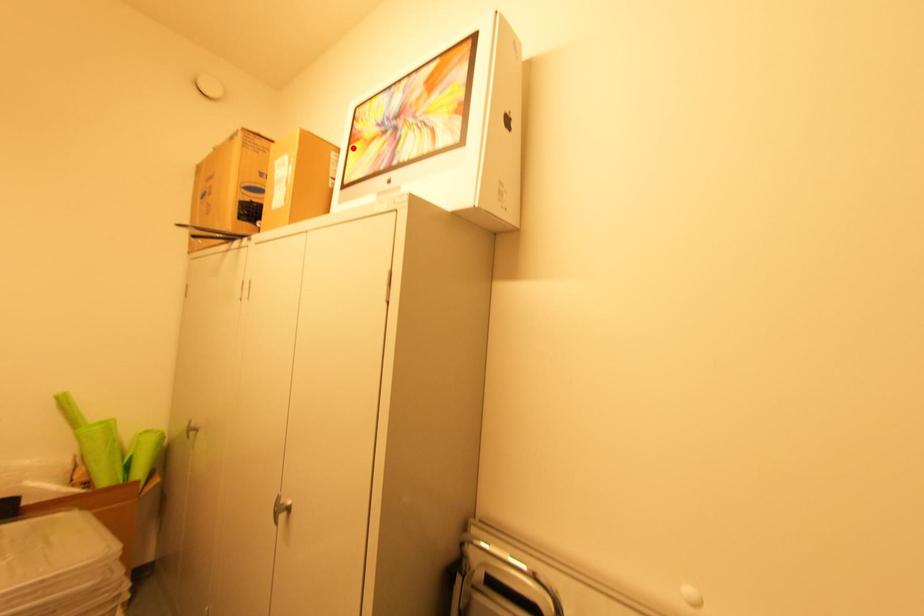
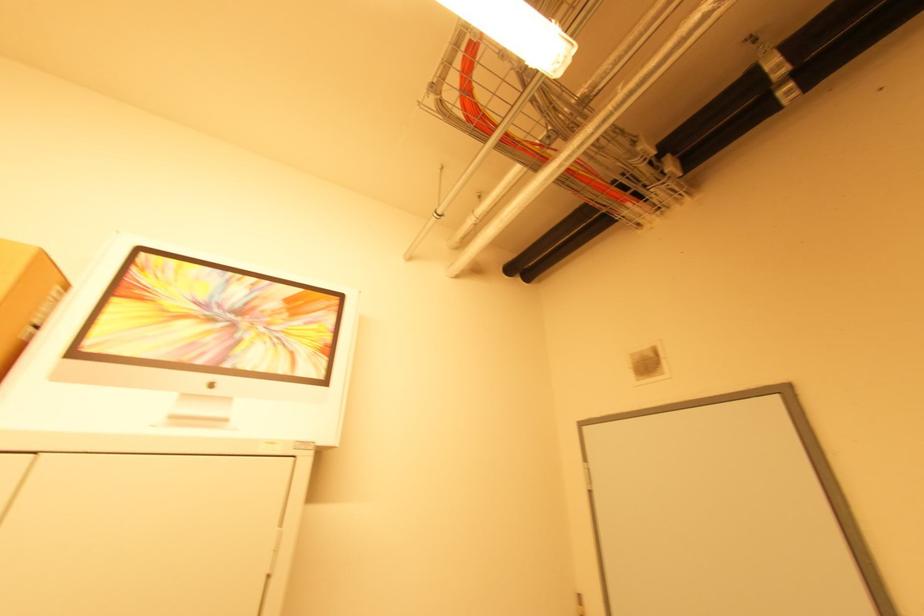
Where in the second image is the point corresponding to the highlighted location from the first image?

(117, 300)